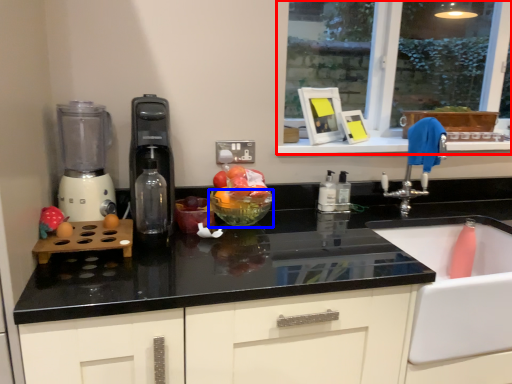
Question: Among these objects, which one is farthest to the camera, window (highlighted by a red box) or glass bowl (highlighted by a blue box)?

Choices:
 (A) window
 (B) glass bowl

Answer: (A)